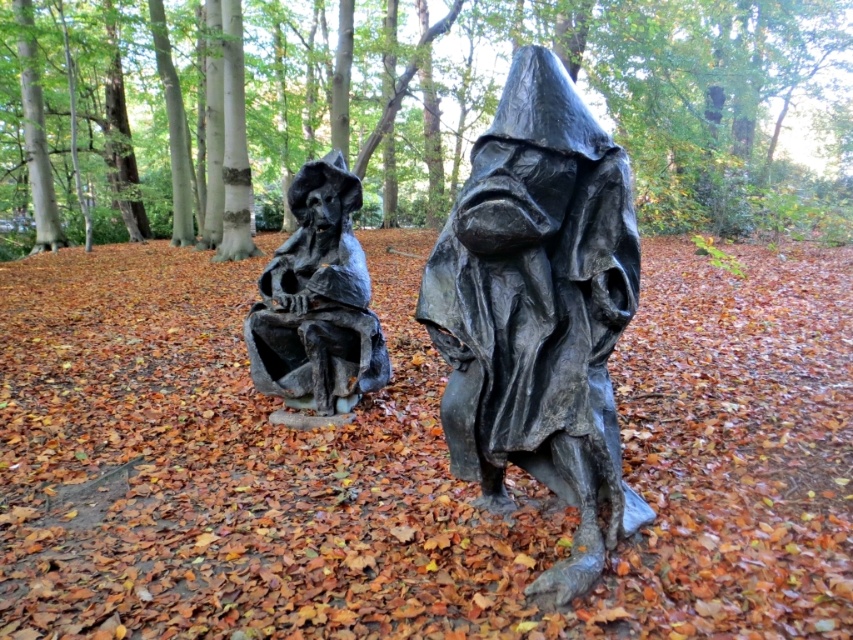
Between matte black figure at center and matte black statue at center, which one is positioned lower?

matte black figure at center is lower down.

Does point (495, 301) lie behind point (317, 360)?

No, (495, 301) is closer to viewer.

Measure the distance between matte black figure at center and camera.

They are 2.06 meters apart.

Locate an element on the screen. Image resolution: width=853 pixels, height=640 pixels. matte black figure at center is located at coordinates (538, 310).